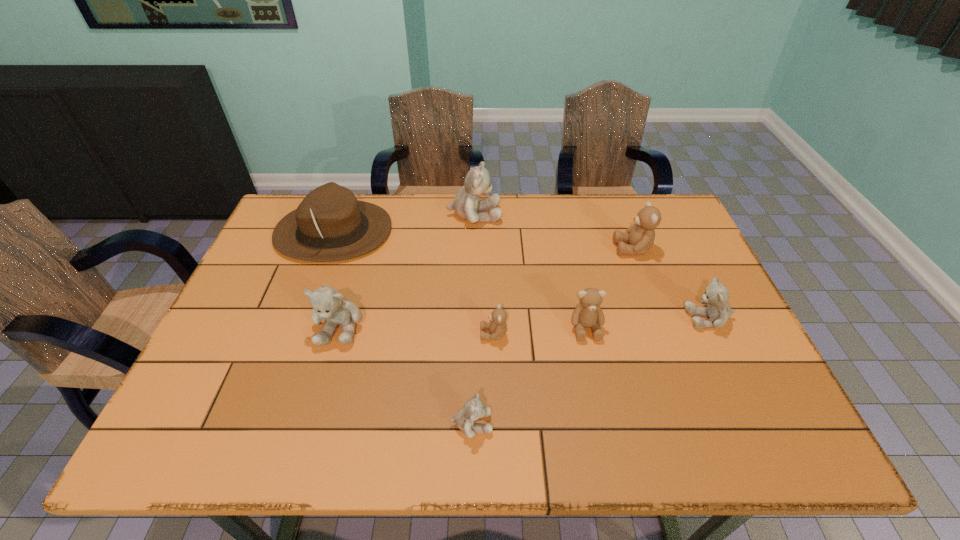
In order to click on object that is at the left edge in this screenshot , I will do `click(330, 224)`.

You are a GUI agent. You are given a task and a screenshot of the screen. Output one action in this format:
    pyautogui.click(x=<x>, y=<y>)
    Task: Click on the object at the far left corner
    This screenshot has height=540, width=960.
    Given the screenshot: What is the action you would take?
    pyautogui.click(x=330, y=224)

What are the coordinates of `object that is at the far right corner` in the screenshot? It's located at (640, 236).

In the image, there is a desktop. Find the location of `free region at the far edge`. free region at the far edge is located at coordinates (429, 211).

Find the location of a particular element. The width and height of the screenshot is (960, 540). vacant space at the near edge of the desktop is located at coordinates (562, 422).

The image size is (960, 540). I want to click on free space at the left edge of the desktop, so click(272, 361).

Identify the location of vacant space at the near left corner. coord(180,421).

Image resolution: width=960 pixels, height=540 pixels. Identify the location of free space between the leftmost brown teddy bear and the tallest teddy bear. (484, 274).

Where is `free space between the fedora and the second object from right to left`? free space between the fedora and the second object from right to left is located at coordinates (483, 240).

Identify the location of empty space that is in between the rightmost teddy bear and the fedora. (521, 275).